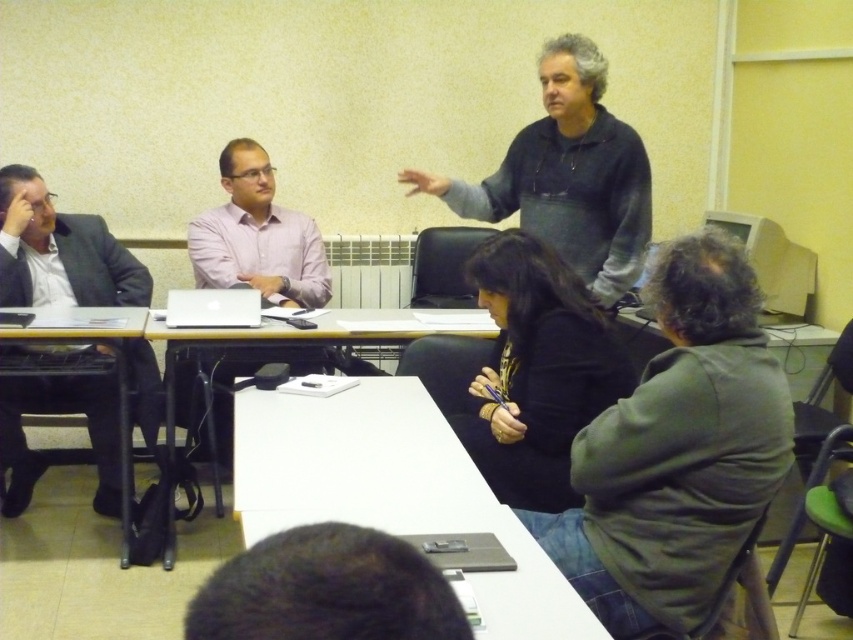
You are a person standing at the entrance of the room. You want to see the dark gray hoodie at upper center and the white glossy table at center clearly. Which object would block your view more if placed in front of you?

The dark gray hoodie at upper center is taller than the white glossy table at center, so it would block your view more if placed in front of you.

You are a person sitting at the white glossy table at center. You want to reach the dark gray hoodie at upper center to grab your keys. Can you comfortably reach it from your current position?

The dark gray hoodie at upper center is 30.78 inches away from the white glossy table at center. Since the distance is about 30.8 inches, which is roughly arm length for an average adult, you can comfortably reach it from your current position.

Where is the dark green hoodie at lower right located in the image?

The dark green hoodie at lower right is located at point (677,451).